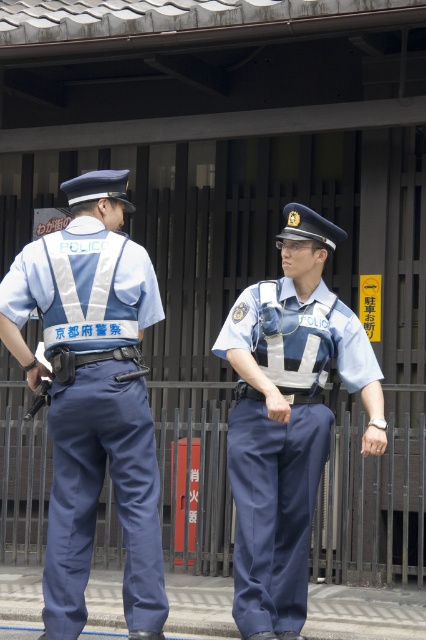
You are a police officer in Kyoto. You need to determine the position of two points marked on a map of the area. The points are labeled as point (255, 586) and point (262, 618). According to the scene, which point is further back from the camera?

Point (255, 586) is behind point (262, 618), so it is further back from the camera.

You are a photographer trying to capture a clear photo of the blue uniform at center located at point (92,396). Based on the scene description, where should you focus your camera to ensure the blue uniform at center is in focus?

You should focus your camera on the point (92,396) where the blue uniform at center is located to ensure it is in focus.